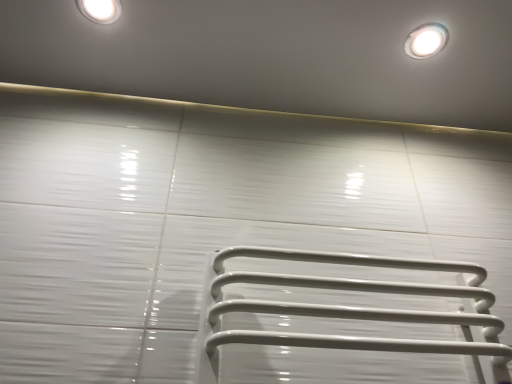
Question: Does white glossy light fixture at upper left have a lesser height compared to white glossy droplight at upper right?

Choices:
 (A) yes
 (B) no

Answer: (A)

Question: Is white glossy light fixture at upper left positioned far away from white glossy droplight at upper right?

Choices:
 (A) no
 (B) yes

Answer: (A)

Question: Is white glossy light fixture at upper left further to camera compared to white glossy droplight at upper right?

Choices:
 (A) yes
 (B) no

Answer: (B)

Question: From a real-world perspective, is white glossy light fixture at upper left positioned under white glossy droplight at upper right based on gravity?

Choices:
 (A) yes
 (B) no

Answer: (B)

Question: Considering the relative sizes of white glossy light fixture at upper left and white glossy droplight at upper right in the image provided, is white glossy light fixture at upper left wider than white glossy droplight at upper right?

Choices:
 (A) no
 (B) yes

Answer: (A)

Question: Considering the relative sizes of white glossy light fixture at upper left and white glossy droplight at upper right in the image provided, is white glossy light fixture at upper left taller than white glossy droplight at upper right?

Choices:
 (A) no
 (B) yes

Answer: (A)

Question: Is white glossy droplight at upper right positioned beyond the bounds of white glossy light fixture at upper left?

Choices:
 (A) no
 (B) yes

Answer: (B)

Question: Can you confirm if white glossy droplight at upper right is smaller than white glossy light fixture at upper left?

Choices:
 (A) no
 (B) yes

Answer: (A)

Question: Does white glossy droplight at upper right have a lesser height compared to white glossy light fixture at upper left?

Choices:
 (A) yes
 (B) no

Answer: (B)

Question: Can you confirm if white glossy droplight at upper right is bigger than white glossy light fixture at upper left?

Choices:
 (A) yes
 (B) no

Answer: (A)

Question: Is white glossy droplight at upper right positioned far away from white glossy light fixture at upper left?

Choices:
 (A) no
 (B) yes

Answer: (A)

Question: Would you say white glossy light fixture at upper left is part of white glossy droplight at upper right's contents?

Choices:
 (A) yes
 (B) no

Answer: (B)

Question: In terms of height, does white glossy droplight at upper right look taller or shorter compared to white glossy light fixture at upper left?

Choices:
 (A) short
 (B) tall

Answer: (B)